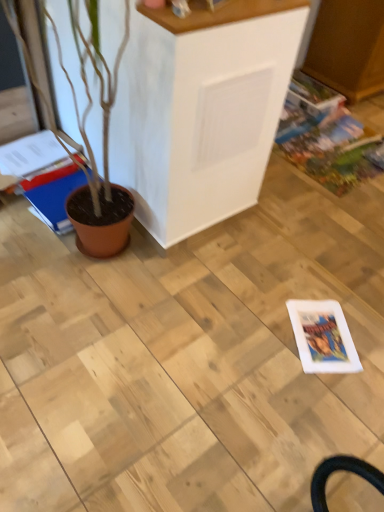
Describe the element at coordinates (324, 136) in the screenshot. The height and width of the screenshot is (512, 384). I see `multicolored glossy comic book at right` at that location.

Find the location of a particular element. The width and height of the screenshot is (384, 512). white matte cabinet at center is located at coordinates (206, 108).

The image size is (384, 512). What are the coordinates of `blue glossy magazine at left, positioned as the first magazine in left-to-right order` in the screenshot? It's located at point(44,176).

Does white matte cabinet at center turn towards matte brown magazine at left, which is counted as the 1th magazine, starting from the right?

No.

Which object is closer to the camera taking this photo, white matte cabinet at center or matte brown magazine at left, which is the 2th magazine from left to right?

Positioned in front is white matte cabinet at center.

Can you confirm if white matte cabinet at center is bigger than matte brown magazine at left, which is the 2th magazine from left to right?

Correct, white matte cabinet at center is larger in size than matte brown magazine at left, which is the 2th magazine from left to right.

From a real-world perspective, who is located higher, blue glossy magazine at left, positioned as the first magazine in left-to-right order, or white matte cabinet at center?

From a 3D spatial view, white matte cabinet at center is above.

Considering the points (43, 192) and (131, 86), which point is behind, point (43, 192) or point (131, 86)?

The point (43, 192) is behind.

Which object is thinner, blue glossy magazine at left, positioned as the first magazine in left-to-right order, or white matte cabinet at center?

white matte cabinet at center.

Is blue glossy magazine at left, positioned as the first magazine in left-to-right order, looking in the opposite direction of white matte cabinet at center?

blue glossy magazine at left, positioned as the first magazine in left-to-right order, does not have its back to white matte cabinet at center.

Between blue glossy magazine at left, the 2th magazine from the right, and matte brown magazine at left, which is the 2th magazine from left to right, which one has more height?

Standing taller between the two is blue glossy magazine at left, the 2th magazine from the right.

From the image's perspective, is blue glossy magazine at left, positioned as the first magazine in left-to-right order, located beneath matte brown magazine at left, which is counted as the 1th magazine, starting from the right?

No, from the image's perspective, blue glossy magazine at left, positioned as the first magazine in left-to-right order, is not below matte brown magazine at left, which is counted as the 1th magazine, starting from the right.

In the image, is blue glossy magazine at left, positioned as the first magazine in left-to-right order, positioned in front of or behind matte brown magazine at left, which is counted as the 1th magazine, starting from the right?

blue glossy magazine at left, positioned as the first magazine in left-to-right order, is behind matte brown magazine at left, which is counted as the 1th magazine, starting from the right.

Measure the distance between blue glossy magazine at left, positioned as the first magazine in left-to-right order, and matte brown magazine at left, which is the 2th magazine from left to right.

5.15 centimeters.

Does multicolored glossy comic book at right turn towards blue glossy magazine at left, the 2th magazine from the right?

No, multicolored glossy comic book at right is not turned towards blue glossy magazine at left, the 2th magazine from the right.

Consider the image. From the image's perspective, is multicolored glossy comic book at right under blue glossy magazine at left, the 2th magazine from the right?

Actually, multicolored glossy comic book at right appears above blue glossy magazine at left, the 2th magazine from the right, in the image.

Is point (307, 113) closer to viewer compared to point (81, 170)?

No.

Looking at this image, is blue glossy magazine at left, the 2th magazine from the right, inside multicolored glossy comic book at right?

No, blue glossy magazine at left, the 2th magazine from the right, is not inside multicolored glossy comic book at right.

Where is `comic book lying above the blue glossy magazine at left, the 2th magazine from the right (from the image's perspective)`? comic book lying above the blue glossy magazine at left, the 2th magazine from the right (from the image's perspective) is located at coordinates (324, 136).

Can you confirm if blue glossy magazine at left, positioned as the first magazine in left-to-right order, is bigger than multicolored glossy comic book at right?

Yes, blue glossy magazine at left, positioned as the first magazine in left-to-right order, is bigger than multicolored glossy comic book at right.

In the scene shown: From the image's perspective, does blue glossy magazine at left, the 2th magazine from the right, appear higher than multicolored glossy comic book at right?

Actually, blue glossy magazine at left, the 2th magazine from the right, appears below multicolored glossy comic book at right in the image.

Based on the photo, between blue glossy magazine at left, the 2th magazine from the right, and multicolored glossy comic book at right, which one has smaller width?

Thinner between the two is blue glossy magazine at left, the 2th magazine from the right.

Are matte brown magazine at left, which is the 2th magazine from left to right, and white matte cabinet at center far apart?

No, matte brown magazine at left, which is the 2th magazine from left to right, is not far from white matte cabinet at center.

Considering the positions of point (84, 184) and point (156, 176), is point (84, 184) closer or farther from the camera than point (156, 176)?

Point (84, 184) is positioned farther from the camera compared to point (156, 176).

From the image's perspective, relative to white matte cabinet at center, is matte brown magazine at left, which is counted as the 1th magazine, starting from the right, above or below?

matte brown magazine at left, which is counted as the 1th magazine, starting from the right, is below white matte cabinet at center.

Considering their positions, is matte brown magazine at left, which is the 2th magazine from left to right, located in front of or behind white matte cabinet at center?

matte brown magazine at left, which is the 2th magazine from left to right, is behind white matte cabinet at center.

In the scene shown: Considering the relative sizes of multicolored glossy comic book at right and white matte cabinet at center in the image provided, is multicolored glossy comic book at right bigger than white matte cabinet at center?

Incorrect, multicolored glossy comic book at right is not larger than white matte cabinet at center.

Measure the distance between multicolored glossy comic book at right and white matte cabinet at center.

multicolored glossy comic book at right and white matte cabinet at center are 34.24 inches apart from each other.

Which is behind, point (315, 145) or point (158, 123)?

The point (315, 145) is farther.

Does multicolored glossy comic book at right touch white matte cabinet at center?

multicolored glossy comic book at right is not next to white matte cabinet at center, and they're not touching.

Starting from the white matte cabinet at center, which magazine is the 1st one behind? Please provide its 2D coordinates.

[(55, 200)]

In the image, there is a blue glossy magazine at left, the 2th magazine from the right. At what (x,y) coordinates should I click in order to perform the action: click on furniture above it (from the image's perspective). Please return your answer as a coordinate pair (x, y). Looking at the image, I should click on (206, 108).

Looking at the image, which one is located closer to white matte cabinet at center, matte brown magazine at left, which is counted as the 1th magazine, starting from the right, or multicolored glossy comic book at right?

The object closer to white matte cabinet at center is matte brown magazine at left, which is counted as the 1th magazine, starting from the right.

Estimate the real-world distances between objects in this image. Which object is closer to multicolored glossy comic book at right, white matte cabinet at center or matte brown magazine at left, which is the 2th magazine from left to right?

white matte cabinet at center is closer to multicolored glossy comic book at right.

Looking at the image, which one is located closer to blue glossy magazine at left, the 2th magazine from the right, multicolored glossy comic book at right or white matte cabinet at center?

white matte cabinet at center lies closer to blue glossy magazine at left, the 2th magazine from the right, than the other object.

From the image, which object appears to be farther from multicolored glossy comic book at right, blue glossy magazine at left, positioned as the first magazine in left-to-right order, or white matte cabinet at center?

blue glossy magazine at left, positioned as the first magazine in left-to-right order, is further to multicolored glossy comic book at right.

In the scene shown: Looking at the image, which one is located closer to blue glossy magazine at left, the 2th magazine from the right, white matte cabinet at center or matte brown magazine at left, which is the 2th magazine from left to right?

matte brown magazine at left, which is the 2th magazine from left to right, is closer to blue glossy magazine at left, the 2th magazine from the right.

Looking at the image, which one is located further to blue glossy magazine at left, the 2th magazine from the right, white matte cabinet at center or multicolored glossy comic book at right?

multicolored glossy comic book at right lies further to blue glossy magazine at left, the 2th magazine from the right, than the other object.

Consider the image. Considering their positions, is matte brown magazine at left, which is counted as the 1th magazine, starting from the right, positioned further to white matte cabinet at center than blue glossy magazine at left, the 2th magazine from the right?

blue glossy magazine at left, the 2th magazine from the right, is further to white matte cabinet at center.

Considering their positions, is blue glossy magazine at left, the 2th magazine from the right, positioned further to white matte cabinet at center than multicolored glossy comic book at right?

The object further to white matte cabinet at center is multicolored glossy comic book at right.

The width and height of the screenshot is (384, 512). Identify the location of furniture between matte brown magazine at left, which is the 2th magazine from left to right, and multicolored glossy comic book at right from left to right. (x=206, y=108).

Locate an element on the screen. The image size is (384, 512). magazine located between blue glossy magazine at left, positioned as the first magazine in left-to-right order, and multicolored glossy comic book at right in the left-right direction is located at coordinates (55, 200).

Locate an element on the screen. magazine between blue glossy magazine at left, positioned as the first magazine in left-to-right order, and white matte cabinet at center from left to right is located at coordinates (55, 200).

You are a GUI agent. You are given a task and a screenshot of the screen. Output one action in this format:
    pyautogui.click(x=<x>, y=<y>)
    Task: Click on the furniture between blue glossy magazine at left, positioned as the first magazine in left-to-right order, and multicolored glossy comic book at right, in the horizontal direction
    The width and height of the screenshot is (384, 512).
    Given the screenshot: What is the action you would take?
    pyautogui.click(x=206, y=108)